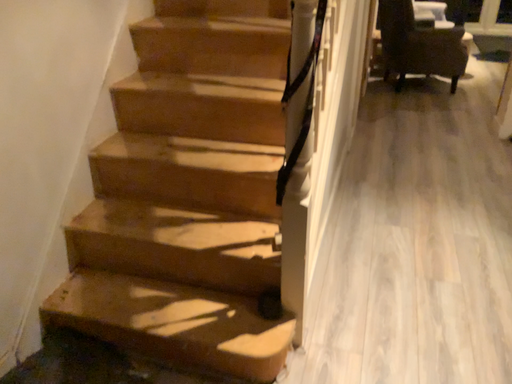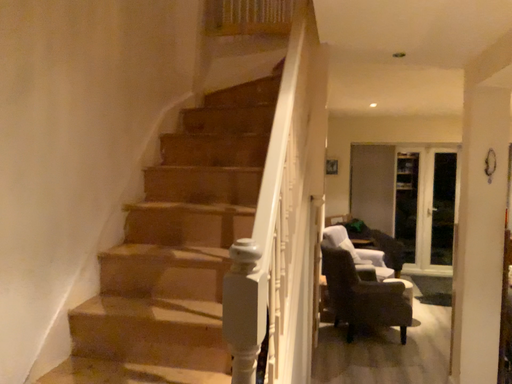
Question: How did the camera likely rotate when shooting the video?

Choices:
 (A) rotated upward
 (B) rotated downward

Answer: (A)